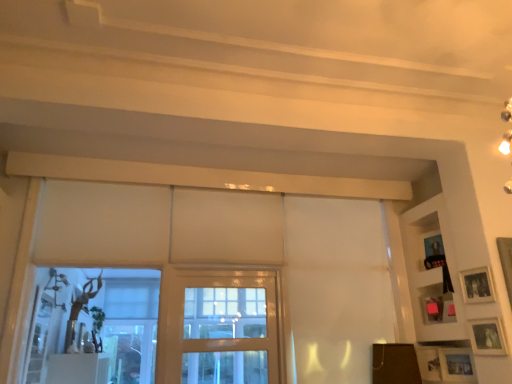
Question: Looking at their shapes, would you say wooden shelf at upper right is wider or thinner than matte black picture frame at upper right, acting as the first picture frame starting from the top?

Choices:
 (A) wide
 (B) thin

Answer: (A)

Question: Considering the positions of wooden shelf at upper right and matte black picture frame at upper right, acting as the fourth picture frame starting from the bottom, in the image, is wooden shelf at upper right bigger or smaller than matte black picture frame at upper right, acting as the fourth picture frame starting from the bottom,?

Choices:
 (A) small
 (B) big

Answer: (B)

Question: Which is farther from the white matte curtain at center?

Choices:
 (A) pink matte picture frame at right, acting as the third picture frame starting from the bottom
 (B) matte white picture frame at lower right, the 3th picture frame when ordered from top to bottom
 (C) clear glass screen door at center
 (D) matte silver picture frame at lower right, the 4th picture frame positioned from the top
 (E) matte black picture frame at upper right, acting as the first picture frame starting from the top

Answer: (B)

Question: Based on their relative distances, which object is farther from the brown matte board at lower right?

Choices:
 (A) matte black picture frame at upper right, acting as the first picture frame starting from the top
 (B) white matte curtain at center
 (C) wooden shelf at upper right
 (D) clear glass screen door at center
 (E) matte white picture frame at lower right, the 2th picture frame positioned from the bottom

Answer: (D)